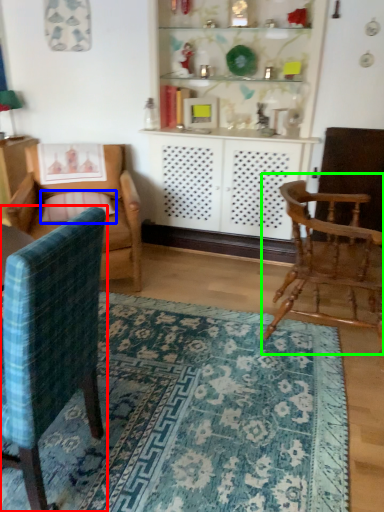
Question: Estimate the real-world distances between objects in this image. Which object is closer to chair (highlighted by a red box), pillow (highlighted by a blue box) or chair (highlighted by a green box)?

Choices:
 (A) pillow
 (B) chair

Answer: (B)